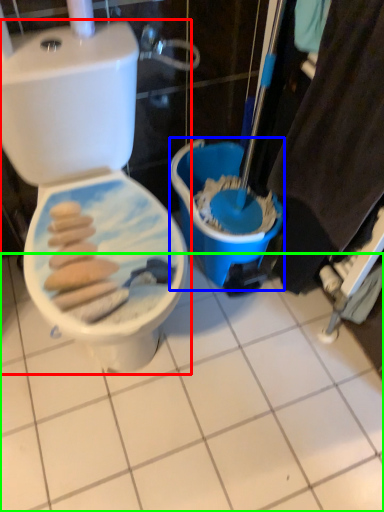
Question: Based on their relative distances, which object is farther from toilet (highlighted by a red box)? Choose from potty (highlighted by a blue box) and ceramic tile (highlighted by a green box).

Choices:
 (A) potty
 (B) ceramic tile

Answer: (B)